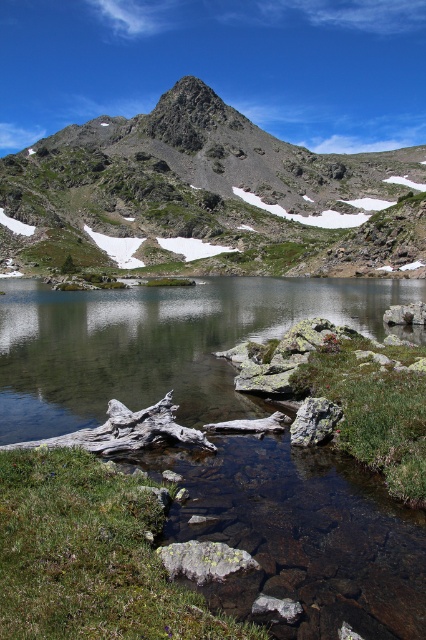
Question: Can you confirm if smooth rock stream at center is thinner than gray rough rock at lower center?

Choices:
 (A) no
 (B) yes

Answer: (A)

Question: Does smooth rock water at center come in front of gray rock at lower center?

Choices:
 (A) yes
 (B) no

Answer: (A)

Question: Which point is farther to the camera?

Choices:
 (A) (0, 342)
 (B) (181, 570)
 (C) (411, 314)

Answer: (C)

Question: Among these points, which one is nearest to the camera?

Choices:
 (A) (23, 289)
 (B) (322, 600)
 (C) (230, 168)
 (D) (340, 412)

Answer: (B)

Question: Which point is farther to the camera?

Choices:
 (A) smooth rock water at center
 (B) gray rock at center
 (C) rocky gray mountain at upper center

Answer: (C)

Question: Does smooth rock water at center have a lesser width compared to gray rough rock at lower center?

Choices:
 (A) no
 (B) yes

Answer: (A)